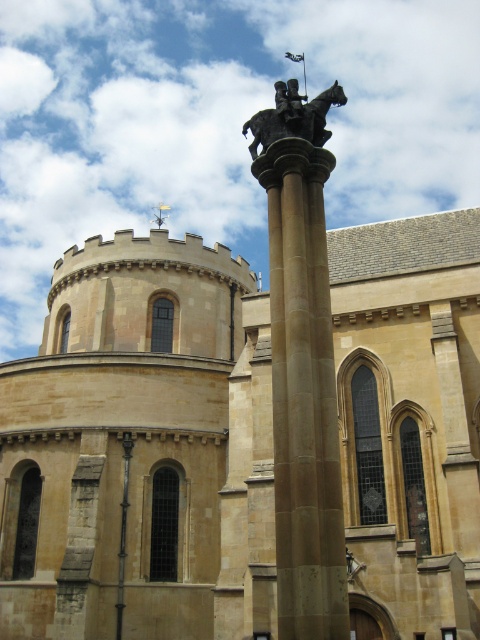
Does beige stone column at center appear over bronze statue at center?

Incorrect, beige stone column at center is not positioned above bronze statue at center.

Can you confirm if beige stone column at center is bigger than bronze statue at center?

Incorrect, beige stone column at center is not larger than bronze statue at center.

The height and width of the screenshot is (640, 480). I want to click on beige stone column at center, so coord(303,396).

The image size is (480, 640). I want to click on beige stone column at center, so click(x=303, y=396).

Image resolution: width=480 pixels, height=640 pixels. I want to click on beige stone church at center, so click(x=141, y=449).

Which is behind, point (155, 435) or point (304, 134)?

The point (155, 435) is more distant.

Locate an element on the screen. The height and width of the screenshot is (640, 480). beige stone church at center is located at coordinates (141, 449).

Does beige stone church at center appear under beige stone column at center?

Incorrect, beige stone church at center is not positioned below beige stone column at center.

What do you see at coordinates (141, 449) in the screenshot? The height and width of the screenshot is (640, 480). I see `beige stone church at center` at bounding box center [141, 449].

Is point (260, 387) positioned in front of point (331, 621)?

No, it is not.

At what (x,y) coordinates should I click in order to perform the action: click on beige stone church at center. Please return your answer as a coordinate pair (x, y). The image size is (480, 640). Looking at the image, I should click on (141, 449).